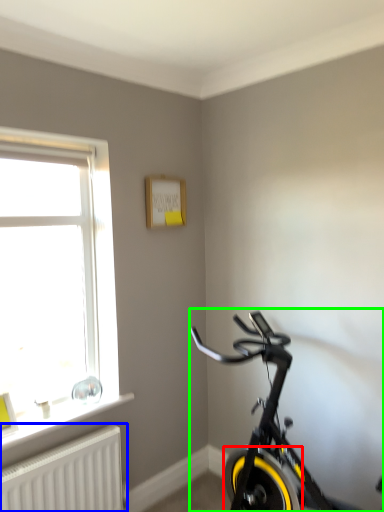
Question: Which object is the closest to the bicycle wheel (highlighted by a red box)? Choose among these: radiator (highlighted by a blue box) or bicycle (highlighted by a green box).

Choices:
 (A) radiator
 (B) bicycle

Answer: (B)